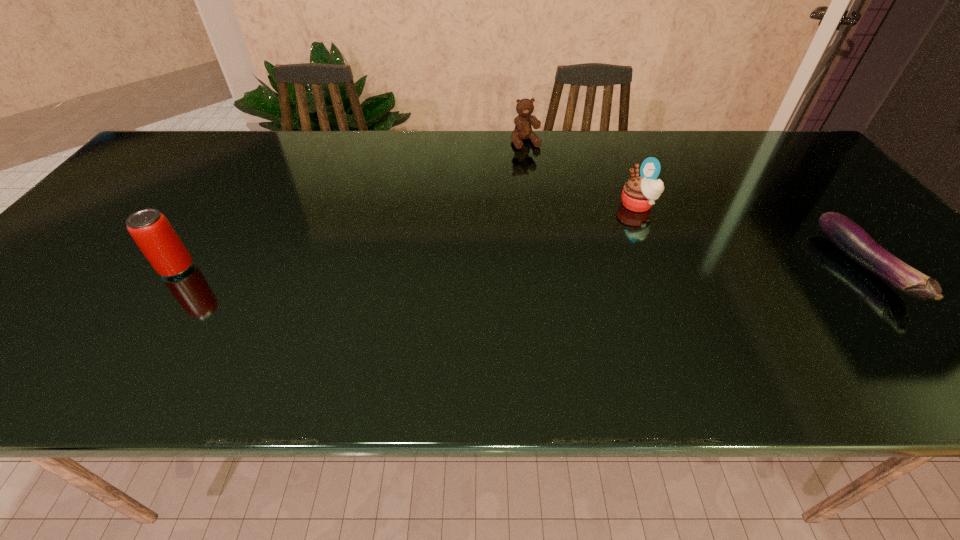
Find the location of `vacant area between the beer can and the farthest object`. vacant area between the beer can and the farthest object is located at coordinates coord(351,205).

Identify the location of empty space that is in between the beer can and the second farthest object. This screenshot has height=540, width=960. (407, 237).

Locate an element on the screen. unoccupied position between the leftmost object and the second object from right to left is located at coordinates (407, 237).

Locate an element on the screen. This screenshot has height=540, width=960. vacant area between the leftmost object and the shortest object is located at coordinates point(520,268).

In order to click on empty space between the third object from right to left and the leftmost object in this screenshot , I will do `click(351, 205)`.

The height and width of the screenshot is (540, 960). I want to click on object that is the second closest to the leftmost object, so click(639, 194).

Find the location of `object that ranks as the second closest to the rightmost object`. object that ranks as the second closest to the rightmost object is located at coordinates (523, 130).

Where is `free space that satisfies the following two spatial constraints: 1. on the back side of the leftmost object; 2. on the right side of the second farthest object`? free space that satisfies the following two spatial constraints: 1. on the back side of the leftmost object; 2. on the right side of the second farthest object is located at coordinates (219, 205).

The height and width of the screenshot is (540, 960). In order to click on vacant point that satisfies the following two spatial constraints: 1. on the back side of the leftmost object; 2. on the right side of the third object from left to right in this screenshot , I will do `click(219, 205)`.

The image size is (960, 540). Identify the location of vacant space that satisfies the following two spatial constraints: 1. on the front side of the shortest object; 2. on the right side of the second farthest object. (662, 267).